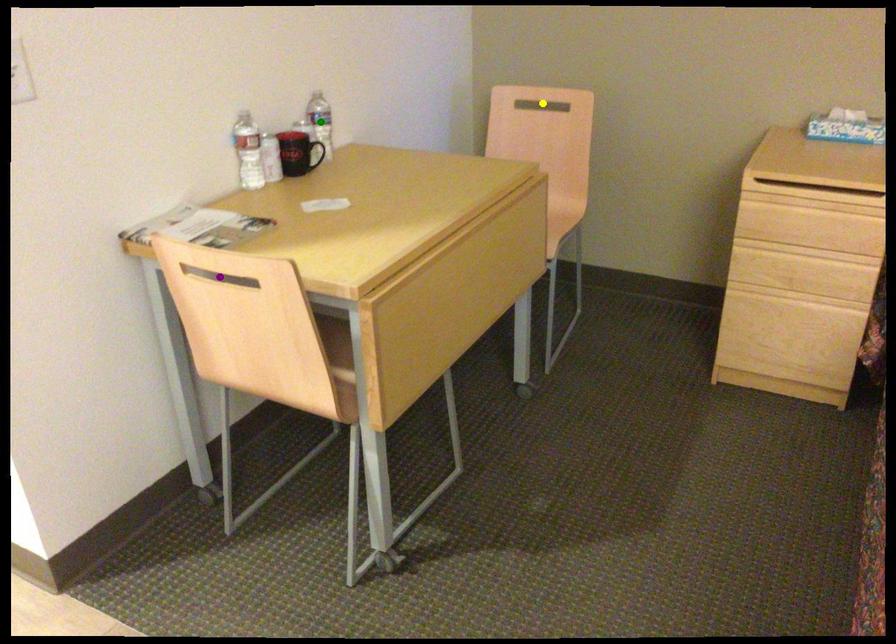
Order these from nearest to farthest:
yellow point | purple point | green point

purple point → green point → yellow point